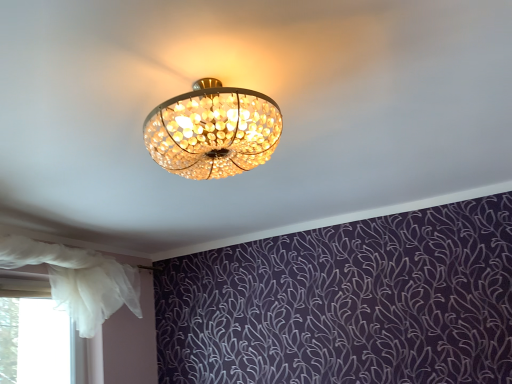
Question: Is white sheer curtain at left in front of or behind white sheer curtain at lower left in the image?

Choices:
 (A) behind
 (B) front

Answer: (B)

Question: Considering the positions of white sheer curtain at left and white sheer curtain at lower left in the image, is white sheer curtain at left wider or thinner than white sheer curtain at lower left?

Choices:
 (A) wide
 (B) thin

Answer: (A)

Question: From the image's perspective, relative to white sheer curtain at lower left, is white sheer curtain at left above or below?

Choices:
 (A) below
 (B) above

Answer: (B)

Question: Considering their positions, is white sheer curtain at lower left located in front of or behind white sheer curtain at left?

Choices:
 (A) front
 (B) behind

Answer: (B)

Question: Considering the positions of white sheer curtain at lower left and white sheer curtain at left in the image, is white sheer curtain at lower left bigger or smaller than white sheer curtain at left?

Choices:
 (A) small
 (B) big

Answer: (A)

Question: Considering the positions of point (9, 370) and point (57, 268), is point (9, 370) closer or farther from the camera than point (57, 268)?

Choices:
 (A) farther
 (B) closer

Answer: (A)

Question: From the image's perspective, is white sheer curtain at lower left positioned above or below white sheer curtain at left?

Choices:
 (A) below
 (B) above

Answer: (A)